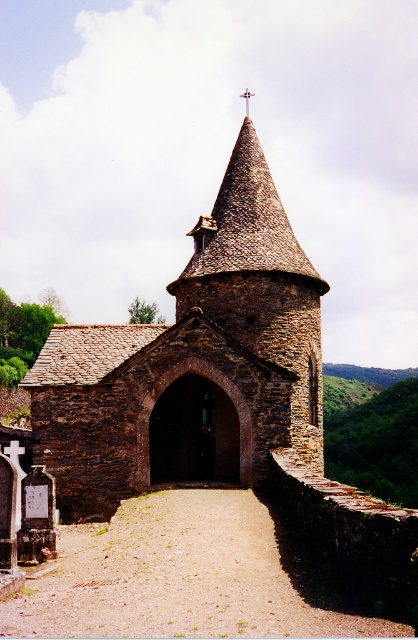
Question: Which of the following is the closest to the observer?

Choices:
 (A) (239, 93)
 (B) (122, 420)

Answer: (B)

Question: Does rustic stone church at center come in front of metallic cross at upper center?

Choices:
 (A) yes
 (B) no

Answer: (A)

Question: Does rustic stone church at center appear on the left side of metallic cross at upper center?

Choices:
 (A) yes
 (B) no

Answer: (A)

Question: Where is rustic stone church at center located in relation to metallic cross at upper center in the image?

Choices:
 (A) below
 (B) above

Answer: (A)

Question: Which of the following is the farthest from the observer?

Choices:
 (A) (160, 422)
 (B) (247, 106)

Answer: (B)